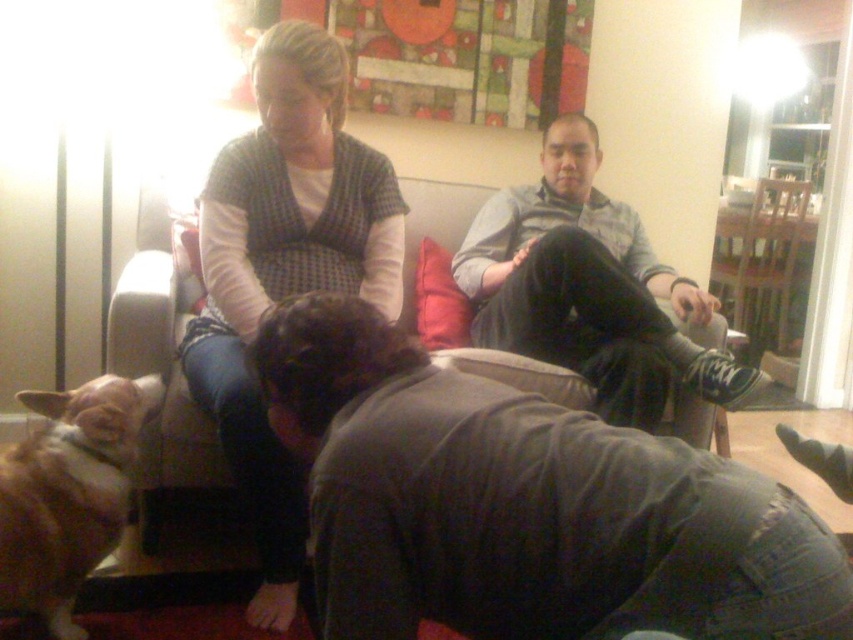
You are standing in the living room and see the dark gray sweater at center. Where exactly is it positioned in terms of coordinates?

The dark gray sweater at center is located at point (589, 289).

You are standing at point (784, 332) and want to move to point (270, 525). Is there a clear path between these two points without any obstacles?

Yes, there is a clear path between point (270, 525) and point (784, 332) because point (270, 525) is in front of point (784, 332), indicating they are aligned along the same line of sight without obstruction.